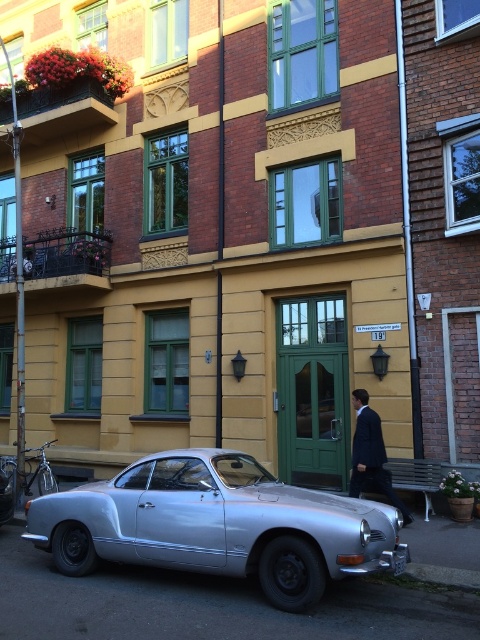
You are a pedestrian standing on the sidewalk and see the silver metallic car at center and the dark blue suit at center. Which object is closer to you?

The silver metallic car at center is closer to you since it is in front of the dark blue suit at center.

Looking at this image, you are standing at the corner of the street and want to take a photo of the silver metallic car at center. According to the coordinates provided, in which direction should you move to position yourself directly in front of the car?

The silver metallic car at center is located at coordinates point (217, 525). To position yourself directly in front of it, you should move towards the car along the line of sight indicated by these coordinates.